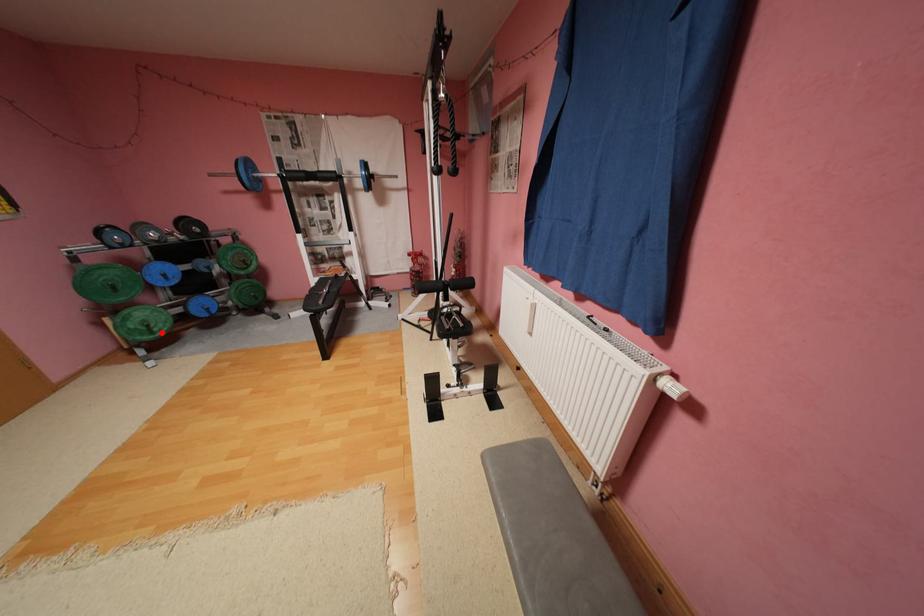
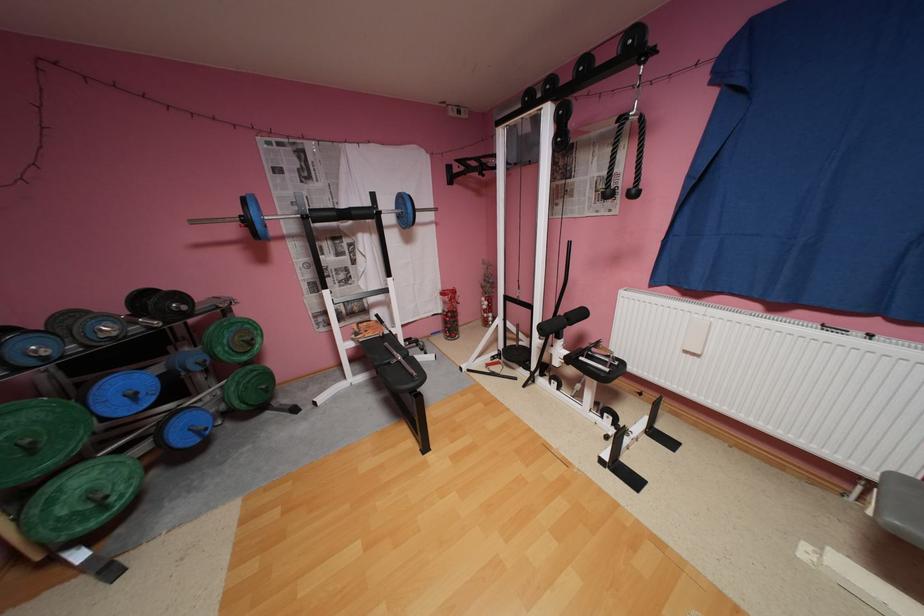
Find the pixel in the second image that matches the highlighted location in the first image.

(116, 508)